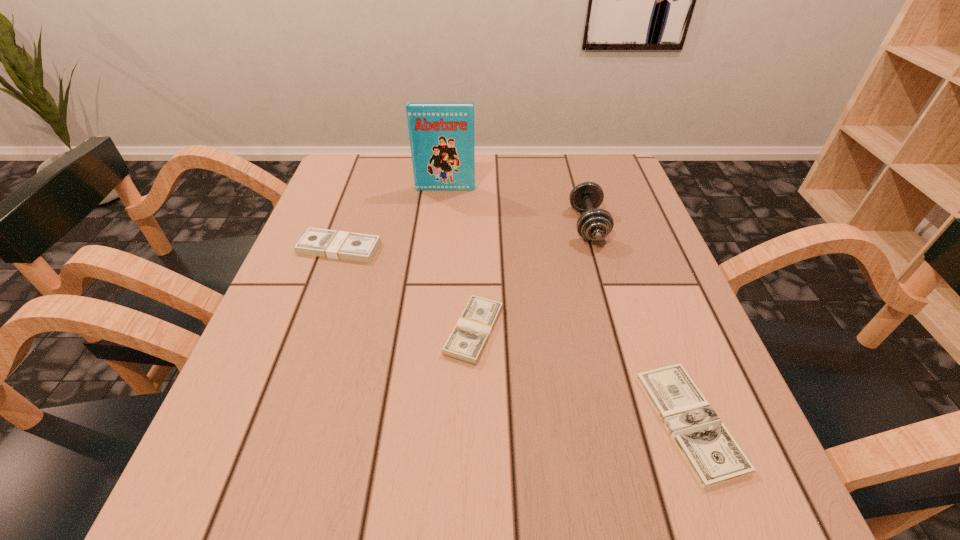
At what (x,y) coordinates should I click in order to perform the action: click on free point between the tallest object and the shortest dollar. Please return your answer as a coordinate pair (x, y). The image size is (960, 540). Looking at the image, I should click on (567, 305).

The width and height of the screenshot is (960, 540). What are the coordinates of `unoccupied position between the fourth shortest object and the shortest dollar` in the screenshot? It's located at click(638, 323).

Image resolution: width=960 pixels, height=540 pixels. What are the coordinates of `unoccupied position between the dumbbell and the tallest object` in the screenshot? It's located at (516, 207).

Identify the location of blank region between the second dollar from left to right and the shortest object. The image size is (960, 540). (582, 376).

The height and width of the screenshot is (540, 960). In order to click on unoccupied position between the second shortest dollar and the tallest object in this screenshot , I will do `click(460, 260)`.

Locate an element on the screen. The image size is (960, 540). vacant space that is in between the shortest object and the dumbbell is located at coordinates (638, 323).

You are a GUI agent. You are given a task and a screenshot of the screen. Output one action in this format:
    pyautogui.click(x=<x>, y=<y>)
    Task: Click on the unoccupied area between the second dollar from right to left and the leftmost object
    This screenshot has height=540, width=960.
    Given the screenshot: What is the action you would take?
    pyautogui.click(x=407, y=289)

Find the location of a particular element. This screenshot has width=960, height=540. vacant region between the farthest dollar and the second nearest object is located at coordinates (407, 289).

This screenshot has width=960, height=540. In order to click on object that stands as the closest to the nearest dollar in this screenshot , I will do `click(469, 337)`.

At what (x,y) coordinates should I click in order to perform the action: click on the third closest object to the dumbbell. Please return your answer as a coordinate pair (x, y). This screenshot has width=960, height=540. Looking at the image, I should click on (713, 455).